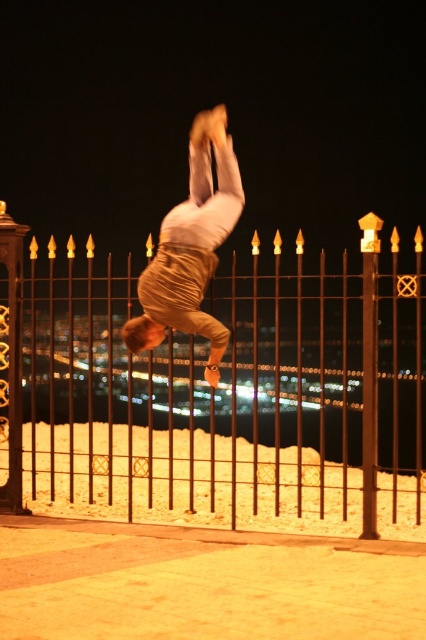
Question: Which point is closer to the camera taking this photo?

Choices:
 (A) coord(91,470)
 (B) coord(201,193)

Answer: (B)

Question: Is black wrought iron fence at center below golden fabric pants at center?

Choices:
 (A) no
 (B) yes

Answer: (B)

Question: Can you confirm if black wrought iron fence at center is positioned to the right of golden fabric pants at center?

Choices:
 (A) no
 (B) yes

Answer: (B)

Question: Is black wrought iron fence at center further to camera compared to golden fabric pants at center?

Choices:
 (A) yes
 (B) no

Answer: (A)